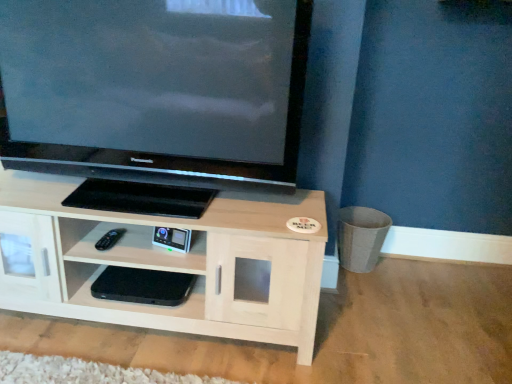
Locate an element on the screen. This screenshot has width=512, height=384. empty space that is ontop of black matte console at center, which ranks as the first shelf in bottom-to-top order (from a real-world perspective) is located at coordinates tap(137, 278).